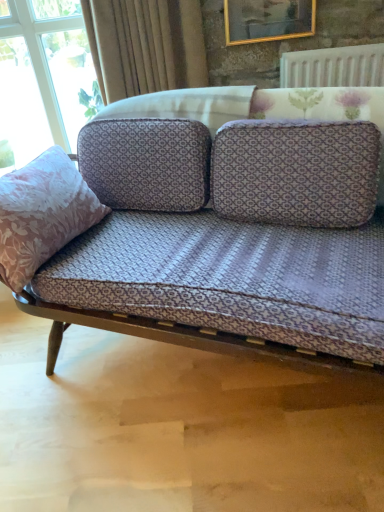
Question: Is gold-framed picture at upper center thinner than pink floral fabric pillow at left?

Choices:
 (A) no
 (B) yes

Answer: (B)

Question: Does gold-framed picture at upper center contain pink floral fabric pillow at left?

Choices:
 (A) no
 (B) yes

Answer: (A)

Question: From the image's perspective, is gold-framed picture at upper center on pink floral fabric pillow at left?

Choices:
 (A) yes
 (B) no

Answer: (A)

Question: Can you see gold-framed picture at upper center touching pink floral fabric pillow at left?

Choices:
 (A) yes
 (B) no

Answer: (B)

Question: From a real-world perspective, is gold-framed picture at upper center on pink floral fabric pillow at left?

Choices:
 (A) yes
 (B) no

Answer: (A)

Question: Based on their sizes in the image, would you say velvet beige curtain at upper center is bigger or smaller than pink floral fabric pillow at left?

Choices:
 (A) small
 (B) big

Answer: (A)

Question: Choose the correct answer: Is velvet beige curtain at upper center inside pink floral fabric pillow at left or outside it?

Choices:
 (A) outside
 (B) inside

Answer: (A)

Question: From the image's perspective, is velvet beige curtain at upper center above or below pink floral fabric pillow at left?

Choices:
 (A) below
 (B) above

Answer: (B)

Question: Considering the positions of velvet beige curtain at upper center and pink floral fabric pillow at left in the image, is velvet beige curtain at upper center taller or shorter than pink floral fabric pillow at left?

Choices:
 (A) tall
 (B) short

Answer: (B)

Question: In terms of height, does gold-framed picture at upper center look taller or shorter compared to white textured radiator at upper right?

Choices:
 (A) tall
 (B) short

Answer: (A)

Question: From a real-world perspective, is gold-framed picture at upper center positioned above or below white textured radiator at upper right?

Choices:
 (A) below
 (B) above

Answer: (B)

Question: Is gold-framed picture at upper center inside the boundaries of white textured radiator at upper right, or outside?

Choices:
 (A) inside
 (B) outside

Answer: (B)

Question: Considering the positions of gold-framed picture at upper center and white textured radiator at upper right in the image, is gold-framed picture at upper center wider or thinner than white textured radiator at upper right?

Choices:
 (A) thin
 (B) wide

Answer: (A)

Question: Is white textured radiator at upper right spatially inside velvet beige curtain at upper center, or outside of it?

Choices:
 (A) outside
 (B) inside

Answer: (A)

Question: Is white textured radiator at upper right bigger or smaller than velvet beige curtain at upper center?

Choices:
 (A) small
 (B) big

Answer: (A)